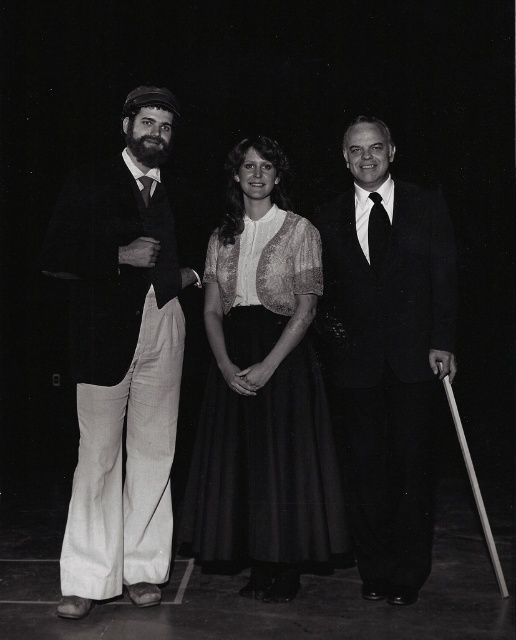
Question: Can you confirm if white cotton pants at left is positioned to the left of smooth black suit at center?

Choices:
 (A) no
 (B) yes

Answer: (B)

Question: Which point appears closest to the camera in this image?

Choices:
 (A) (110, 573)
 (B) (101, 484)
 (C) (389, 221)

Answer: (B)

Question: Which point appears farthest from the camera in this image?

Choices:
 (A) (391, 436)
 (B) (256, 211)

Answer: (B)

Question: Does matte black dress at center have a lesser width compared to smooth black suit at center?

Choices:
 (A) yes
 (B) no

Answer: (B)

Question: Can you confirm if matte black dress at center is bigger than smooth black suit at center?

Choices:
 (A) no
 (B) yes

Answer: (A)

Question: Which point is closer to the camera?

Choices:
 (A) matte white blouse at center
 (B) smooth black suit at center

Answer: (B)